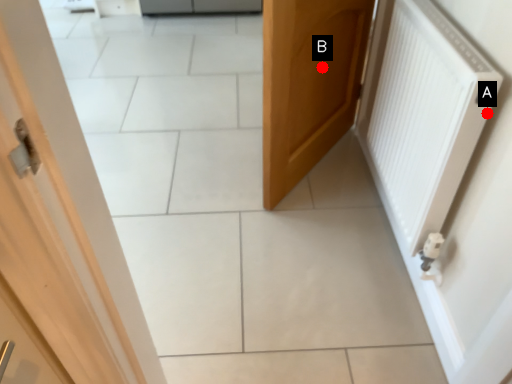
Question: Two points are circled on the image, labeled by A and B beside each circle. Among these points, which one is nearest to the camera?

Choices:
 (A) A is closer
 (B) B is closer

Answer: (A)